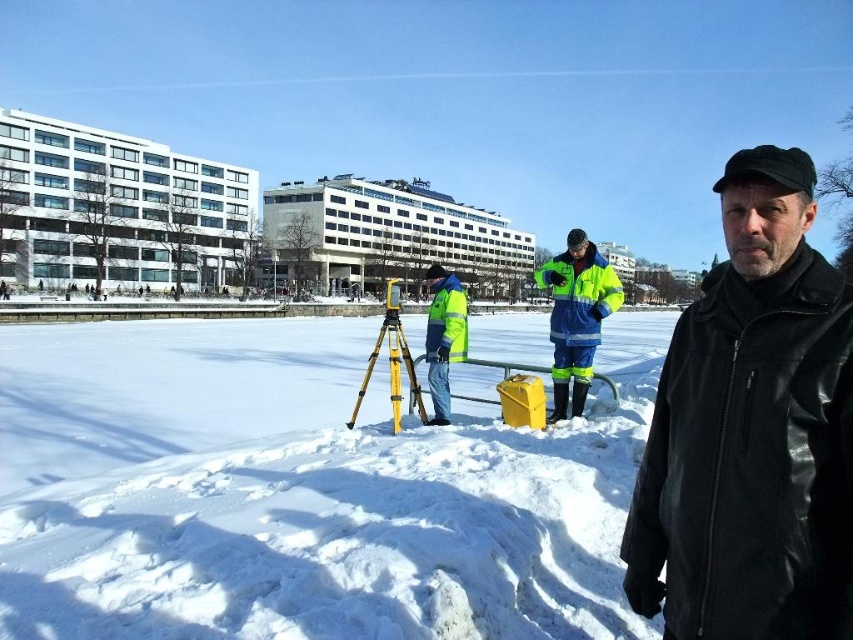
You are a hiker trying to cross the area where the white powdery snow at center and the yellow matte tripod at center are located. Which object is higher in elevation?

The yellow matte tripod at center is taller than the white powdery snow at center, so the tripod is higher in elevation.

You are standing at the camera position and want to place a new surveying marker. The marker needs to be placed exactly at the white powdery snow at center. According to the coordinates provided, where should you place it?

The white powdery snow at center should be placed at coordinates point [299,492].